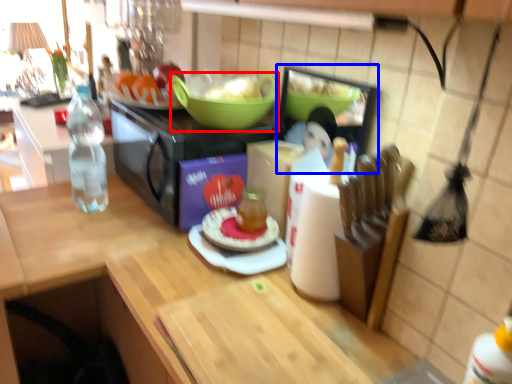
Question: Which object is closer to the camera taking this photo, bowl (highlighted by a red box) or appliance (highlighted by a blue box)?

Choices:
 (A) bowl
 (B) appliance

Answer: (B)